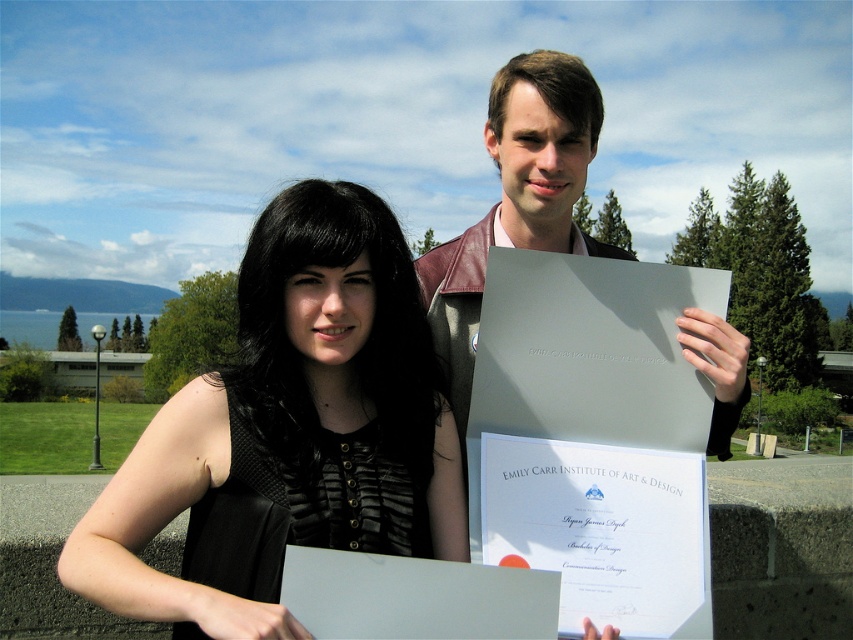
Question: Can you confirm if black matte dress at center is bigger than leather jacket at center?

Choices:
 (A) yes
 (B) no

Answer: (B)

Question: Does black matte dress at center come in front of leather jacket at center?

Choices:
 (A) no
 (B) yes

Answer: (B)

Question: Which point is farther from the camera taking this photo?

Choices:
 (A) (543, 211)
 (B) (368, 228)

Answer: (A)

Question: Observing the image, what is the correct spatial positioning of black matte dress at center in reference to leather jacket at center?

Choices:
 (A) left
 (B) right

Answer: (A)

Question: Which of the following is the closest to the observer?

Choices:
 (A) click(x=585, y=140)
 (B) click(x=105, y=536)

Answer: (B)